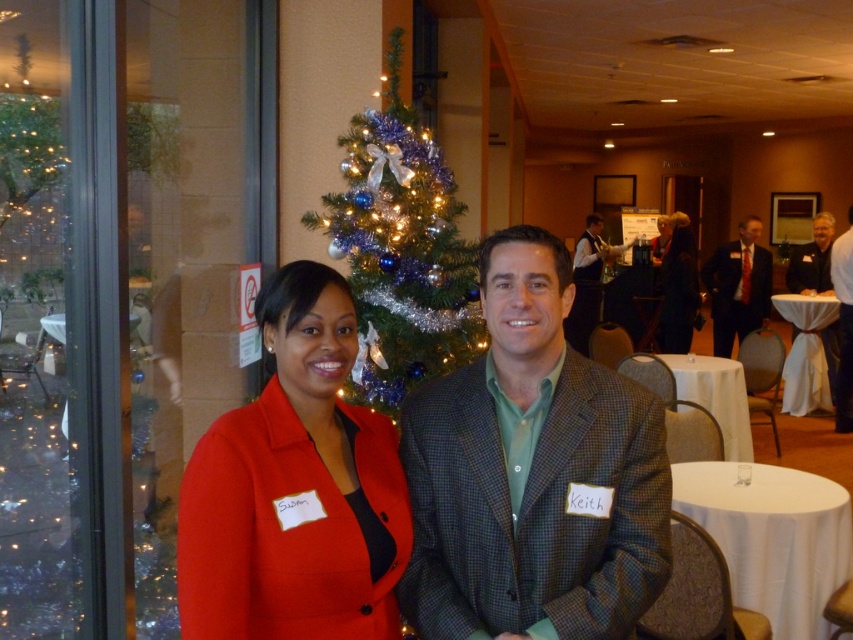
You are a photographer setting up for a group photo. You need to ensure that the matte black suit at right and the light brown leather jacket at right are both visible in the frame. Given their height difference, which one might you need to adjust the camera angle to focus on first?

The matte black suit at right is shorter than the light brown leather jacket at right, so you should focus on the matte black suit at right first to ensure it is fully visible in the frame.

You are a photographer setting up for a group photo. You need to ensure that the green wool blazer at center and the white tablecloth at center are both visible in the frame. Based on their positions, which one should you focus on first to ensure both are in the shot?

The green wool blazer at center is located above the white tablecloth at center, so focusing on the green wool blazer at center first will ensure both are in the frame since it is higher up and the tablecloth is below it.

You are a photographer at a holiday event and need to position two guests for a photo. The guests are wearing the matte black suit at right and the light brown leather jacket at right. According to the scene, which guest should stand on the left side of the photo to match their original positions?

The matte black suit at right should stand on the left side of the photo because it is already positioned to the left of the light brown leather jacket at right in the original scene.